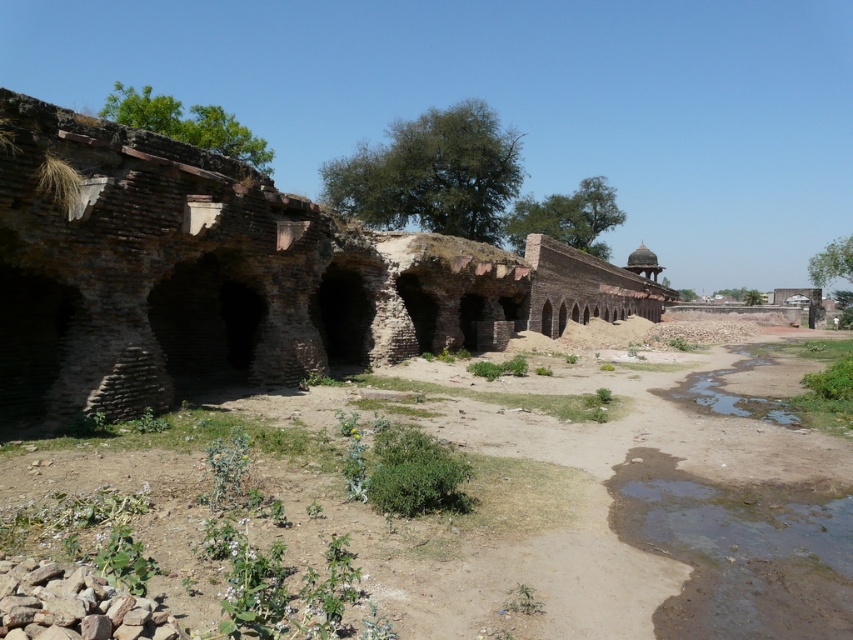
Question: From the image, what is the correct spatial relationship of brown sandy dirt field at center in relation to brown brick ruins at center?

Choices:
 (A) below
 (B) above

Answer: (A)

Question: Which of the following is the farthest from the observer?

Choices:
 (A) brown brick ruins at center
 (B) brown sandy dirt field at center

Answer: (A)

Question: Considering the relative positions of brown sandy dirt field at center and brown brick ruins at center in the image provided, where is brown sandy dirt field at center located with respect to brown brick ruins at center?

Choices:
 (A) left
 (B) right

Answer: (A)

Question: Which of the following is the closest to the observer?

Choices:
 (A) (82, 241)
 (B) (669, 468)

Answer: (B)

Question: Considering the relative positions of brown sandy dirt field at center and brown brick ruins at center in the image provided, where is brown sandy dirt field at center located with respect to brown brick ruins at center?

Choices:
 (A) below
 (B) above

Answer: (A)